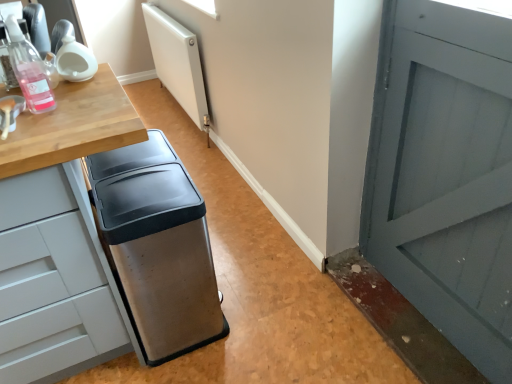
Locate an element on the screen. The image size is (512, 384). free space in front of translucent plastic bottle at left is located at coordinates [x=34, y=130].